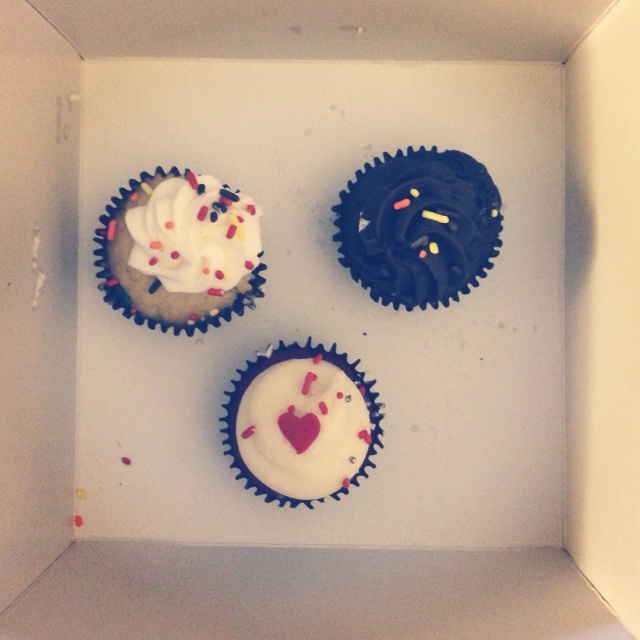
Question: Which of the following is the farthest from the observer?

Choices:
 (A) white matte cupcake at center
 (B) chocolate frosted cupcake at upper right
 (C) white matte cupcake at upper left

Answer: (A)

Question: Can you confirm if white matte cupcake at upper left is smaller than white matte cupcake at center?

Choices:
 (A) no
 (B) yes

Answer: (A)

Question: Is the position of chocolate frosted cupcake at upper right less distant than that of white matte cupcake at center?

Choices:
 (A) no
 (B) yes

Answer: (B)

Question: Which object appears closest to the camera in this image?

Choices:
 (A) chocolate frosted cupcake at upper right
 (B) white matte cupcake at center
 (C) white matte cupcake at upper left

Answer: (C)

Question: Which point is farther to the camera?

Choices:
 (A) white matte cupcake at upper left
 (B) chocolate frosted cupcake at upper right
 (C) white matte cupcake at center

Answer: (C)

Question: Can you confirm if white matte cupcake at upper left is positioned below chocolate frosted cupcake at upper right?

Choices:
 (A) yes
 (B) no

Answer: (A)